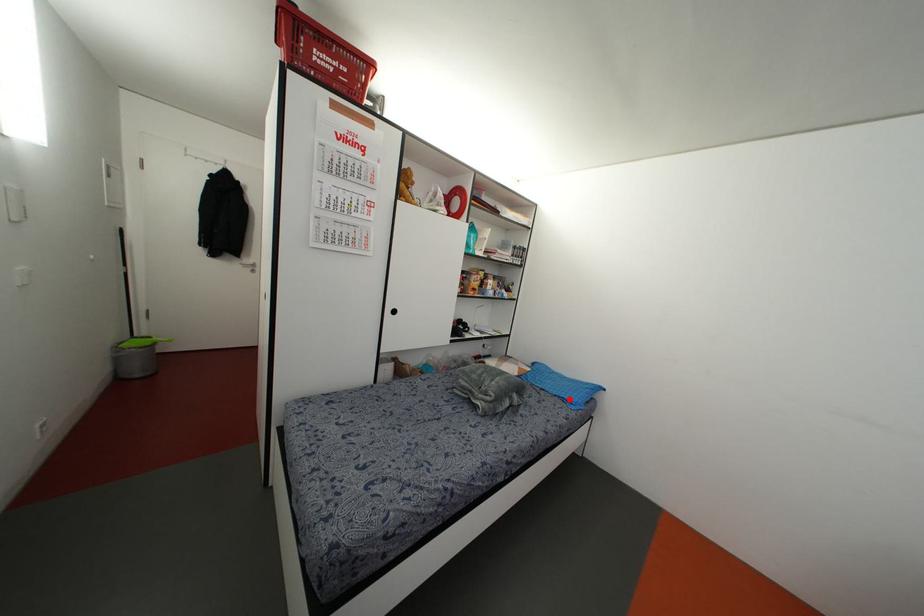
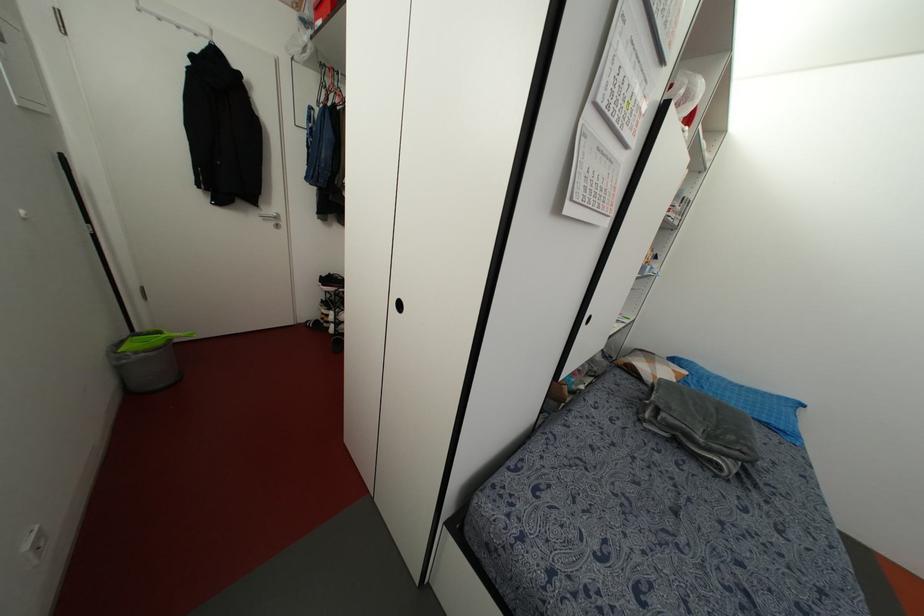
In the second image, find the point that corresponds to the highlighted location in the first image.

(782, 427)